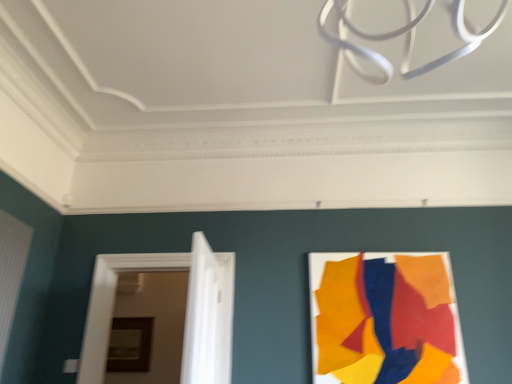
Question: From a real-world perspective, is white painted wood door at left, acting as the first door starting from the back, positioned under matte acrylic poster at right based on gravity?

Choices:
 (A) no
 (B) yes

Answer: (B)

Question: Considering the relative sizes of white painted wood door at left, acting as the first door starting from the back, and matte acrylic poster at right in the image provided, is white painted wood door at left, acting as the first door starting from the back, bigger than matte acrylic poster at right?

Choices:
 (A) yes
 (B) no

Answer: (A)

Question: Is white painted wood door at left, which ranks as the second door in front-to-back order, thinner than matte acrylic poster at right?

Choices:
 (A) yes
 (B) no

Answer: (B)

Question: Is matte acrylic poster at right at the back of white painted wood door at left, which ranks as the second door in front-to-back order?

Choices:
 (A) no
 (B) yes

Answer: (A)

Question: Can you confirm if white painted wood door at left, acting as the first door starting from the back, is positioned to the left of matte acrylic poster at right?

Choices:
 (A) yes
 (B) no

Answer: (A)

Question: From a real-world perspective, is white glossy door at center, marked as the second door in a back-to-front arrangement, positioned above or below wooden picture frame at center?

Choices:
 (A) above
 (B) below

Answer: (A)

Question: Relative to wooden picture frame at center, is white glossy door at center, marked as the first door in a front-to-back arrangement, in front or behind?

Choices:
 (A) front
 (B) behind

Answer: (A)

Question: Based on their positions, is white glossy door at center, marked as the second door in a back-to-front arrangement, located to the left or right of wooden picture frame at center?

Choices:
 (A) right
 (B) left

Answer: (A)

Question: Considering the positions of point (220, 350) and point (138, 365), is point (220, 350) closer or farther from the camera than point (138, 365)?

Choices:
 (A) closer
 (B) farther

Answer: (A)

Question: Is white glossy door at center, marked as the first door in a front-to-back arrangement, in front of or behind white painted wood door at left, acting as the first door starting from the back, in the image?

Choices:
 (A) behind
 (B) front

Answer: (B)

Question: Looking at their shapes, would you say white glossy door at center, marked as the second door in a back-to-front arrangement, is wider or thinner than white painted wood door at left, which ranks as the second door in front-to-back order?

Choices:
 (A) wide
 (B) thin

Answer: (B)

Question: Is white glossy door at center, marked as the second door in a back-to-front arrangement, taller or shorter than white painted wood door at left, acting as the first door starting from the back?

Choices:
 (A) short
 (B) tall

Answer: (A)

Question: From the image's perspective, relative to white painted wood door at left, which ranks as the second door in front-to-back order, is white glossy door at center, marked as the second door in a back-to-front arrangement, above or below?

Choices:
 (A) above
 (B) below

Answer: (A)

Question: Choose the correct answer: Is matte acrylic poster at right inside white glossy door at center, marked as the second door in a back-to-front arrangement, or outside it?

Choices:
 (A) outside
 (B) inside

Answer: (A)

Question: Is matte acrylic poster at right taller or shorter than white glossy door at center, marked as the first door in a front-to-back arrangement?

Choices:
 (A) tall
 (B) short

Answer: (A)